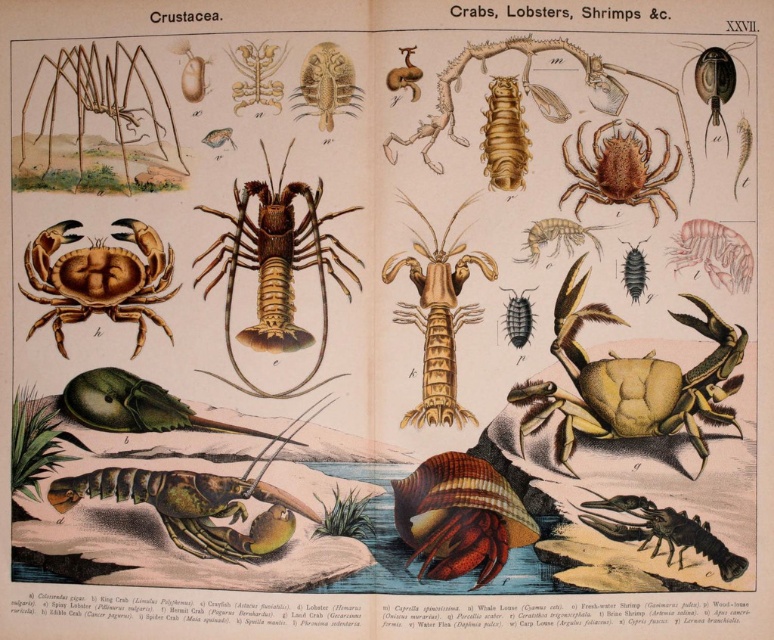
Question: Can you confirm if matte brown crab at center is smaller than brown matte spider at upper center?

Choices:
 (A) yes
 (B) no

Answer: (A)

Question: Which object appears farthest from the camera in this image?

Choices:
 (A) matte brown crab at center
 (B) shiny brown hermit crab at center

Answer: (A)

Question: Is matte yellow crab at lower right below smooth beige spider at center?

Choices:
 (A) no
 (B) yes

Answer: (B)

Question: Among these objects, which one is farthest from the camera?

Choices:
 (A) brown matte spider at upper center
 (B) brown matte lobster at center

Answer: (B)

Question: Considering the real-world distances, which object is farthest from the shiny brown hermit crab at center?

Choices:
 (A) brown matte spider at upper center
 (B) smooth beige spider at center
 (C) matte brown crab at center
 (D) brown matte lobster at center

Answer: (C)

Question: Does matte brown crab at center have a lesser width compared to brown textured crab at upper right?

Choices:
 (A) no
 (B) yes

Answer: (A)